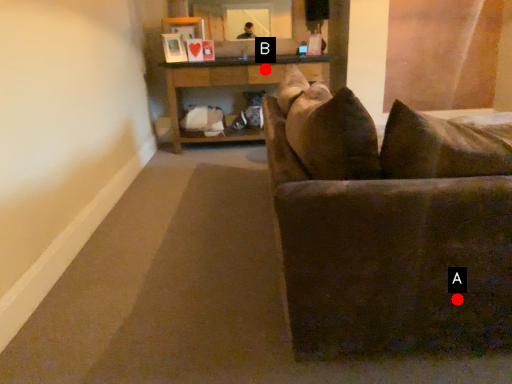
Question: Two points are circled on the image, labeled by A and B beside each circle. Among these points, which one is nearest to the camera?

Choices:
 (A) A is closer
 (B) B is closer

Answer: (A)